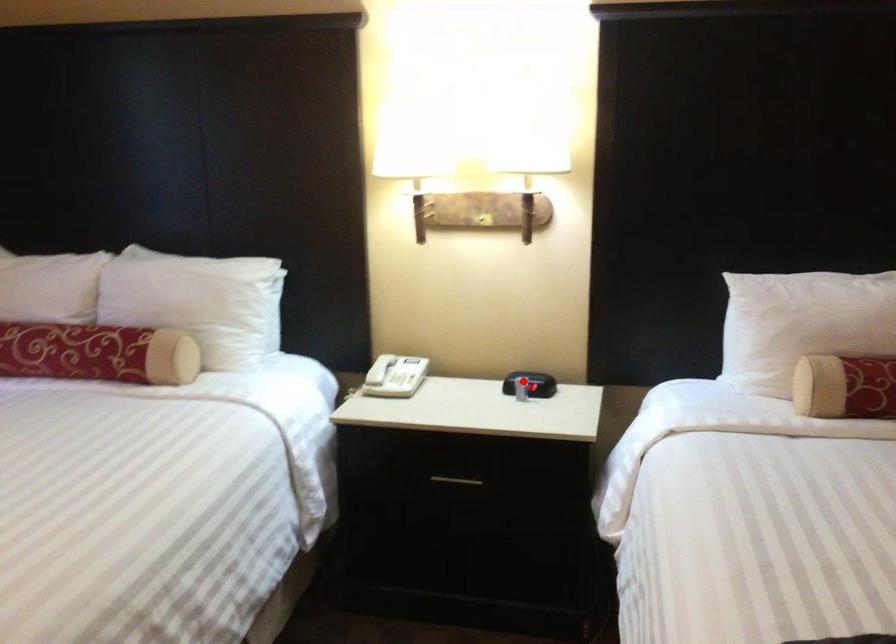
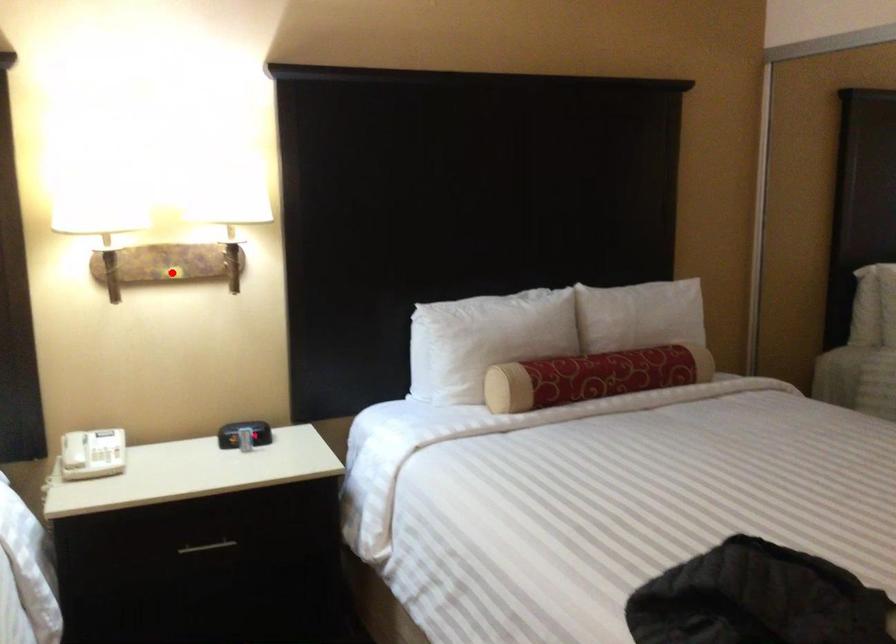
I am providing you with two images of the same scene from different viewpoints. A red point is marked on the first image and another point is marked on the second image. Are the points marked in image1 and image2 representing the same 3D position?

No